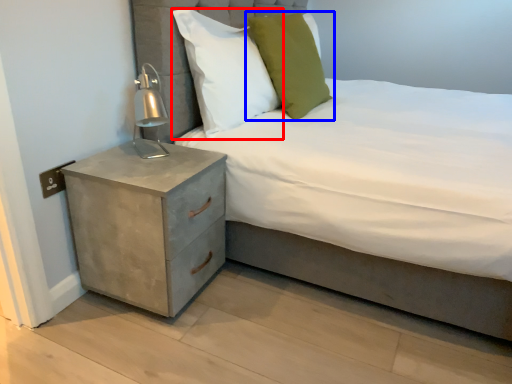
Question: Which object is closer to the camera taking this photo, pillow (highlighted by a red box) or pillow (highlighted by a blue box)?

Choices:
 (A) pillow
 (B) pillow

Answer: (A)